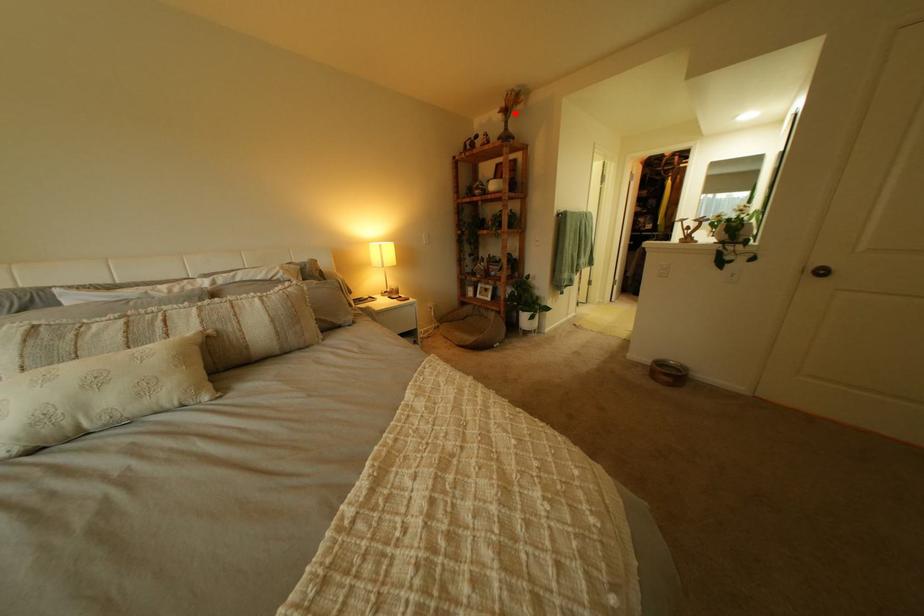
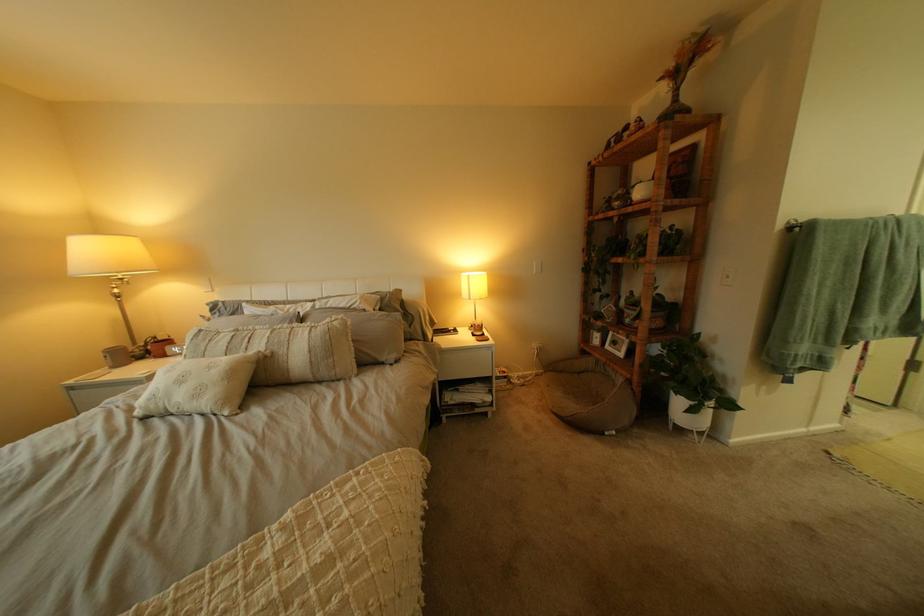
Question: I am providing you with two images of the same scene from different viewpoints. In image1, a red point is highlighted. Considering the same 3D point in image2, which of the following is correct?

Choices:
 (A) It is closer
 (B) It is farther

Answer: (B)